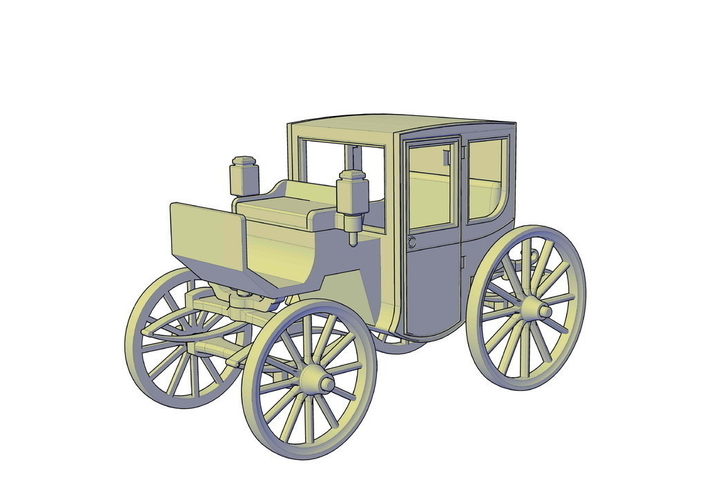
Where is `seat`? This screenshot has width=707, height=500. seat is located at coordinates point(493,206), point(430,187).